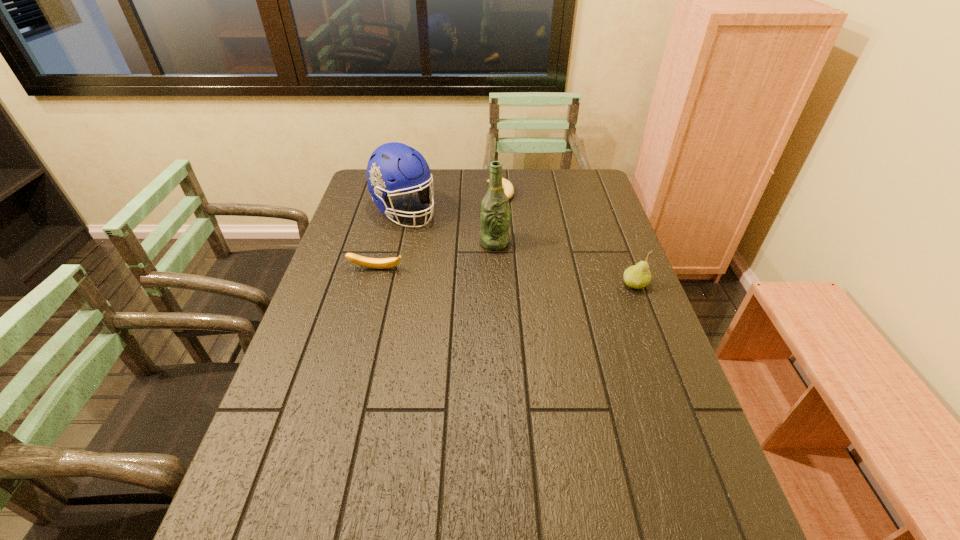
Locate an element on the screen. vacant area between the pear and the football helmet is located at coordinates (519, 248).

At what (x,y) coordinates should I click in order to perform the action: click on free space that is in between the beer bottle and the second tallest object. Please return your answer as a coordinate pair (x, y). Looking at the image, I should click on (449, 226).

Locate an element on the screen. The height and width of the screenshot is (540, 960). free spot between the shorter banana and the fourth farthest object is located at coordinates (439, 232).

Where is `vacant space that's between the second shortest object and the third farthest object`? Image resolution: width=960 pixels, height=540 pixels. vacant space that's between the second shortest object and the third farthest object is located at coordinates (436, 255).

This screenshot has height=540, width=960. Identify the location of vacant area that lies between the nearer banana and the third farthest object. (436, 255).

What are the coordinates of `free space between the football helmet and the pear` in the screenshot? It's located at (519, 248).

Identify the location of empty space between the nearer banana and the football helmet. This screenshot has height=540, width=960. (391, 240).

The image size is (960, 540). I want to click on object that is the fourth closest to the nearest object, so click(378, 263).

Locate which object ranks fourth in proximity to the farther banana. Please provide its 2D coordinates. Your answer should be formatted as a tuple, i.e. [(x, y)], where the tuple contains the x and y coordinates of a point satisfying the conditions above.

[(638, 276)]

In order to click on vacant region that satisfies the following two spatial constraints: 1. on the back side of the shorter banana; 2. on the left side of the beer bottle in this screenshot , I will do `click(492, 194)`.